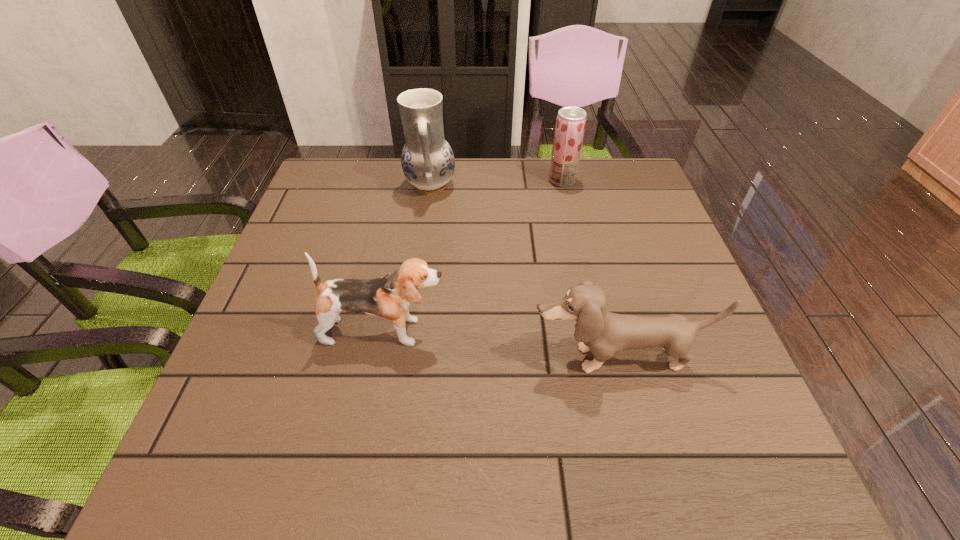
The height and width of the screenshot is (540, 960). I want to click on free space that satisfies the following two spatial constraints: 1. on the front side of the fruit juice; 2. at the face of the left puppy, so click(x=597, y=332).

Image resolution: width=960 pixels, height=540 pixels. Identify the location of vacant space that satisfies the following two spatial constraints: 1. on the back side of the pottery; 2. on the right side of the fruit juice. (431, 180).